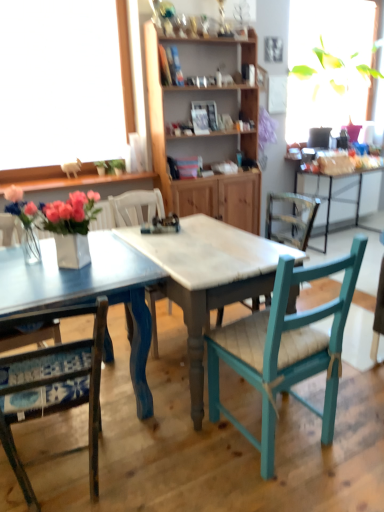
Question: Is white glossy vase at center outside of blue fabric cushioned chair at lower left, the third chair positioned from the right?

Choices:
 (A) no
 (B) yes

Answer: (B)

Question: Is white glossy vase at center smaller than blue fabric cushioned chair at lower left, the 1th chair in the left-to-right sequence?

Choices:
 (A) yes
 (B) no

Answer: (A)

Question: Does white glossy vase at center have a lesser width compared to blue fabric cushioned chair at lower left, the 1th chair in the left-to-right sequence?

Choices:
 (A) no
 (B) yes

Answer: (B)

Question: Is blue fabric cushioned chair at lower left, the 1th chair in the left-to-right sequence, located within white glossy vase at center?

Choices:
 (A) yes
 (B) no

Answer: (B)

Question: From the image's perspective, is white glossy vase at center under blue fabric cushioned chair at lower left, the third chair positioned from the right?

Choices:
 (A) no
 (B) yes

Answer: (A)

Question: From a real-world perspective, is white glossy vase at center below blue fabric cushioned chair at lower left, the 1th chair in the left-to-right sequence?

Choices:
 (A) yes
 (B) no

Answer: (B)

Question: Does wooden chair at center, which is the second chair in left-to-right order, turn towards blue fabric cushioned chair at lower left, the 1th chair in the left-to-right sequence?

Choices:
 (A) no
 (B) yes

Answer: (A)

Question: Is wooden chair at center, which is the second chair in left-to-right order, wider than blue fabric cushioned chair at lower left, the third chair positioned from the right?

Choices:
 (A) yes
 (B) no

Answer: (A)

Question: Is wooden chair at center, which is the second chair in left-to-right order, in contact with blue fabric cushioned chair at lower left, the third chair positioned from the right?

Choices:
 (A) no
 (B) yes

Answer: (A)

Question: Is wooden chair at center, marked as the 2th chair in a right-to-left arrangement, to the left of blue fabric cushioned chair at lower left, the 1th chair in the left-to-right sequence, from the viewer's perspective?

Choices:
 (A) yes
 (B) no

Answer: (B)

Question: Considering the relative sizes of wooden chair at center, which is the second chair in left-to-right order, and blue fabric cushioned chair at lower left, the 1th chair in the left-to-right sequence, in the image provided, is wooden chair at center, which is the second chair in left-to-right order, thinner than blue fabric cushioned chair at lower left, the 1th chair in the left-to-right sequence,?

Choices:
 (A) no
 (B) yes

Answer: (A)

Question: Is wooden chair at center, marked as the 2th chair in a right-to-left arrangement, far away from blue fabric cushioned chair at lower left, the third chair positioned from the right?

Choices:
 (A) yes
 (B) no

Answer: (A)

Question: Is teal wood chair at center, the 1th chair viewed from the right, behind white glossy vase at center?

Choices:
 (A) no
 (B) yes

Answer: (A)